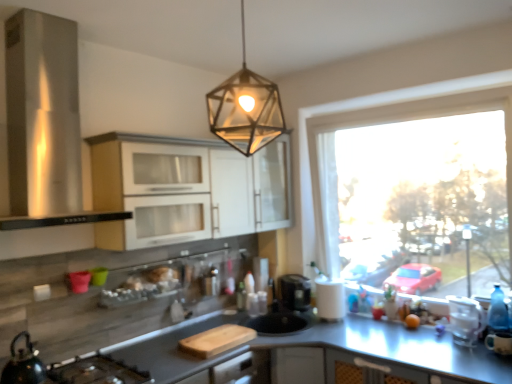
Locate an element on the screen. The image size is (512, 384). vacant area that is in front of clear plastic container at right is located at coordinates (468, 355).